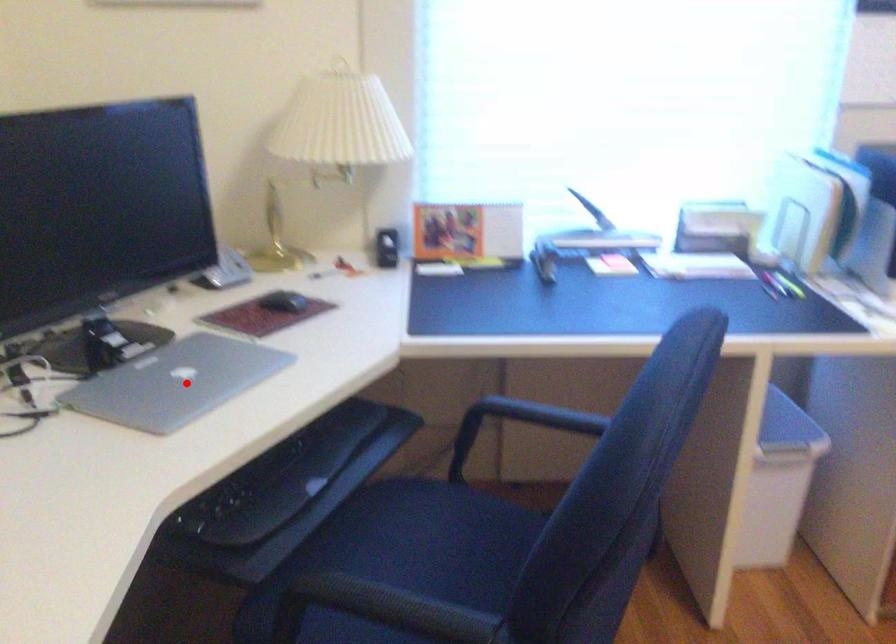
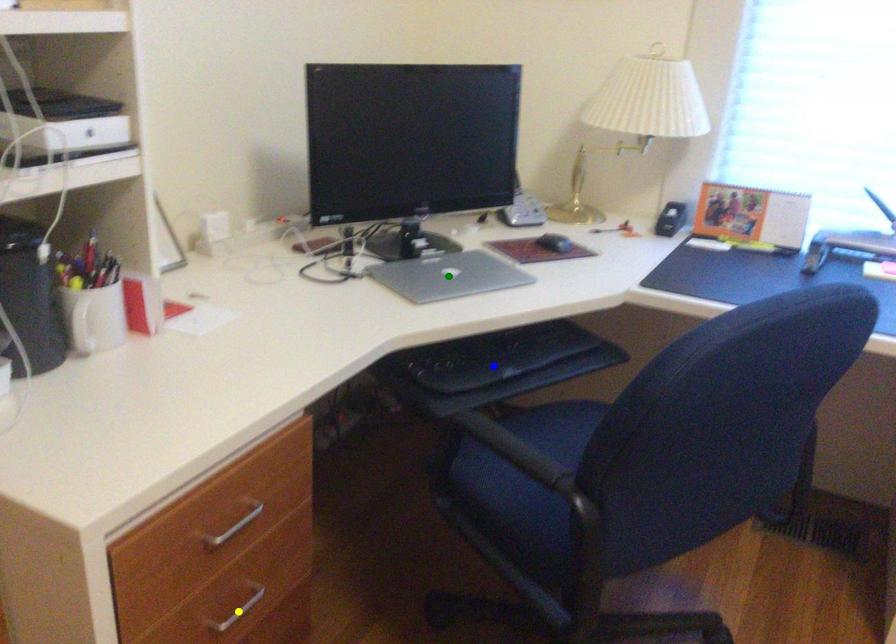
Question: I am providing you with two images of the same scene from different viewpoints. A red point is marked on the first image. You are given multiple points on the second image. In image 2, which mark is for the same physical point as the one in image 1?

Choices:
 (A) green point
 (B) yellow point
 (C) blue point

Answer: (A)